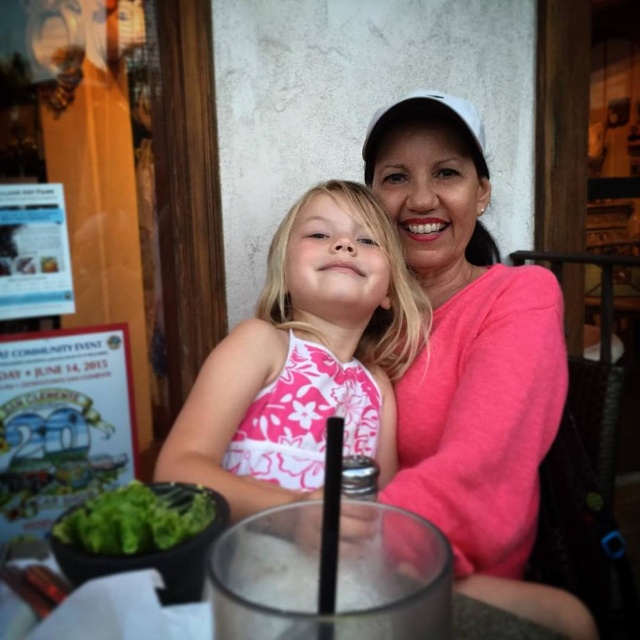
Question: Is pink cotton sweater at upper right to the left of pink floral dress at center from the viewer's perspective?

Choices:
 (A) no
 (B) yes

Answer: (A)

Question: From the image, what is the correct spatial relationship of pink floral dress at center in relation to green leafy vegetable at lower left?

Choices:
 (A) below
 (B) above

Answer: (B)

Question: Which object appears farthest from the camera in this image?

Choices:
 (A) green leafy vegetable at lower left
 (B) pink floral dress at center
 (C) pink cotton sweater at upper right

Answer: (C)

Question: Among these objects, which one is nearest to the camera?

Choices:
 (A) pink cotton sweater at upper right
 (B) green leafy vegetable at lower left

Answer: (B)

Question: Can you confirm if pink floral dress at center is positioned to the right of green leafy vegetable at lower left?

Choices:
 (A) yes
 (B) no

Answer: (A)

Question: Which of the following is the farthest from the observer?

Choices:
 (A) (262, 300)
 (B) (112, 520)

Answer: (A)